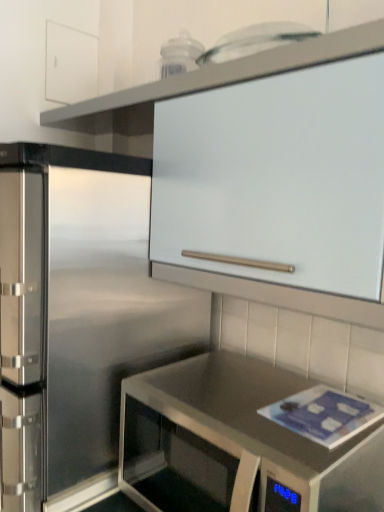
Question: Is point (48, 31) positioned closer to the camera than point (200, 68)?

Choices:
 (A) closer
 (B) farther

Answer: (B)

Question: Considering their positions, is white matte cabinet at upper left, positioned as the 2th cabinetry in right-to-left order, located in front of or behind white matte cabinet at upper center, acting as the 1th cabinetry starting from the right?

Choices:
 (A) front
 (B) behind

Answer: (B)

Question: Based on their relative distances, which object is farther from the stainless steel countertop at lower right?

Choices:
 (A) white matte cabinet at upper left, the 1th cabinetry in the back-to-front sequence
 (B) white matte cabinet at upper center, the 2th cabinetry in the top-to-bottom sequence

Answer: (A)

Question: Estimate the real-world distances between objects in this image. Which object is closer to the white matte cabinet at upper center, which ranks as the 2th cabinetry in left-to-right order?

Choices:
 (A) white matte cabinet at upper left, arranged as the second cabinetry when viewed from the front
 (B) stainless steel countertop at lower right

Answer: (A)